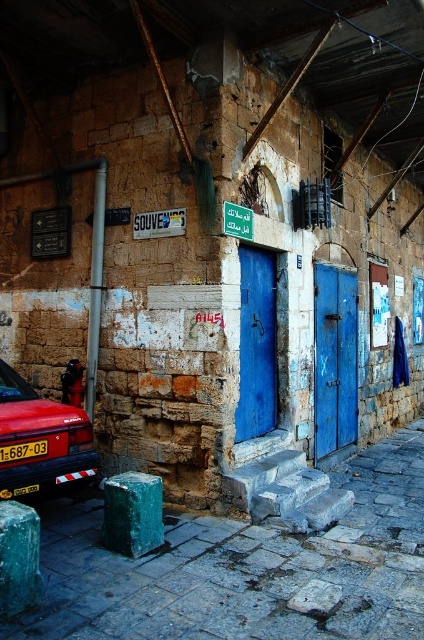
Locate an element on the screen. Image resolution: width=424 pixels, height=640 pixels. blue painted wood door at center is located at coordinates (334, 358).

In the scene shown: Is the position of blue painted wood door at center less distant than that of green textured block at lower center?

No, it is not.

Does point (351, 344) come in front of point (113, 492)?

No, it is behind (113, 492).

I want to click on blue painted wood door at center, so click(x=334, y=358).

Between blue painted wood door at center and blue matte door at center, which one has more height?

With more height is blue painted wood door at center.

Which is behind, point (323, 336) or point (259, 253)?

Positioned behind is point (323, 336).

This screenshot has height=640, width=424. I want to click on blue painted wood door at center, so click(x=334, y=358).

Between green textured block at lower center and green plastic sign at upper center, which one has less height?

green plastic sign at upper center is shorter.

Which of these two, green textured block at lower center or green plastic sign at upper center, stands taller?

green textured block at lower center is taller.

Describe the element at coordinates (133, 513) in the screenshot. The image size is (424, 640). I see `green textured block at lower center` at that location.

Image resolution: width=424 pixels, height=640 pixels. In order to click on green textured block at lower center in this screenshot , I will do `click(133, 513)`.